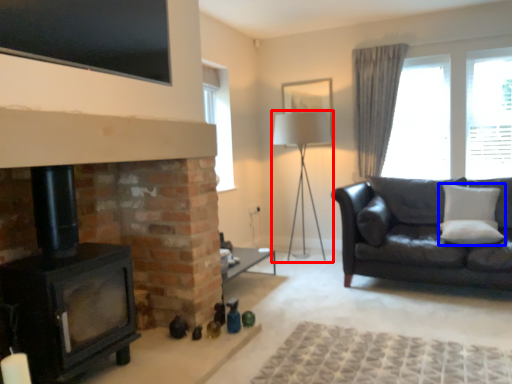
Question: Which point is closer to the camera, table lamp (highlighted by a red box) or pillow (highlighted by a blue box)?

Choices:
 (A) table lamp
 (B) pillow

Answer: (B)